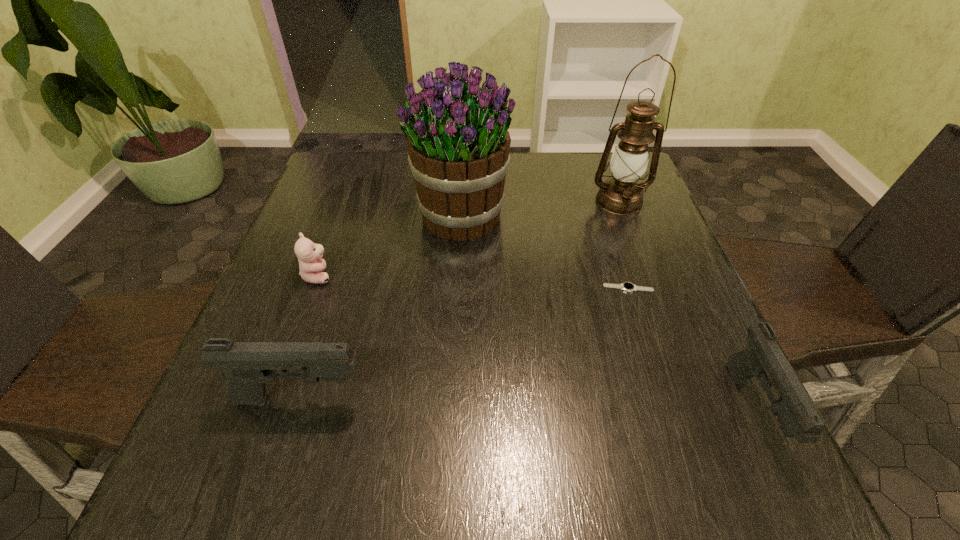
Locate an element on the screen. the taller pistol is located at coordinates (249, 365).

Where is `the third tallest object`? Image resolution: width=960 pixels, height=540 pixels. the third tallest object is located at coordinates (249, 365).

Where is `the third shortest object`? the third shortest object is located at coordinates (763, 358).

Locate an element on the screen. the rightmost object is located at coordinates point(763,358).

The width and height of the screenshot is (960, 540). I want to click on bouquet, so click(x=458, y=145).

Where is `oil lamp`? The width and height of the screenshot is (960, 540). oil lamp is located at coordinates (622, 195).

The width and height of the screenshot is (960, 540). Identify the location of watch. (629, 287).

You are a GUI agent. You are given a task and a screenshot of the screen. Output one action in this format:
    pyautogui.click(x=<x>, y=<y>)
    Task: Click on the fifth tallest object
    
    Given the screenshot: What is the action you would take?
    pyautogui.click(x=311, y=266)

Locate an element on the screen. The height and width of the screenshot is (540, 960). vacant space located 0.290m at the barrel of the fourth shortest object is located at coordinates (540, 399).

I want to click on vacant area situated 0.340m on the front of the fourth object from right to left, so click(x=453, y=376).